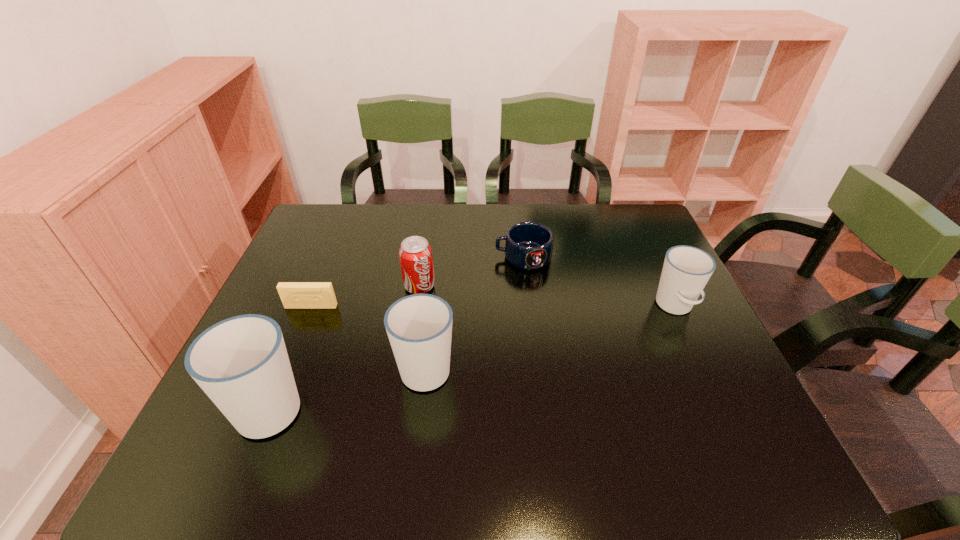
Locate which object ranks fifth in proximity to the shortest cup. Please provide its 2D coordinates. Your answer should be formatted as a tuple, i.e. [(x, y)], where the tuple contains the x and y coordinates of a point satisfying the conditions above.

[(294, 295)]

Identify which object is the third closest to the soda. Please provide its 2D coordinates. Your answer should be formatted as a tuple, i.e. [(x, y)], where the tuple contains the x and y coordinates of a point satisfying the conditions above.

[(528, 245)]

This screenshot has width=960, height=540. Identify the location of cup that stands as the closest to the rightmost cup. (419, 327).

You are a GUI agent. You are given a task and a screenshot of the screen. Output one action in this format:
    pyautogui.click(x=<x>, y=<y>)
    Task: Click on the cup that is the second closest to the videotape
    The width and height of the screenshot is (960, 540).
    Given the screenshot: What is the action you would take?
    pyautogui.click(x=419, y=327)

You are a GUI agent. You are given a task and a screenshot of the screen. Output one action in this format:
    pyautogui.click(x=<x>, y=<y>)
    Task: Click on the vacant space that satisfies the following two spatial constraints: 1. with the handle on the side of the fifth object from left to right; 2. at the front of the videotape with spools
    The width and height of the screenshot is (960, 540).
    Given the screenshot: What is the action you would take?
    pyautogui.click(x=529, y=307)

I want to click on vacant space that satisfies the following two spatial constraints: 1. with a handle on the side of the leftmost cup; 2. on the right side of the soda, so click(320, 286).

Where is `free space that satisfies the following two spatial constraints: 1. with the handle on the side of the fifth object from left to right; 2. on the front side of the soda`? Image resolution: width=960 pixels, height=540 pixels. free space that satisfies the following two spatial constraints: 1. with the handle on the side of the fifth object from left to right; 2. on the front side of the soda is located at coordinates (527, 286).